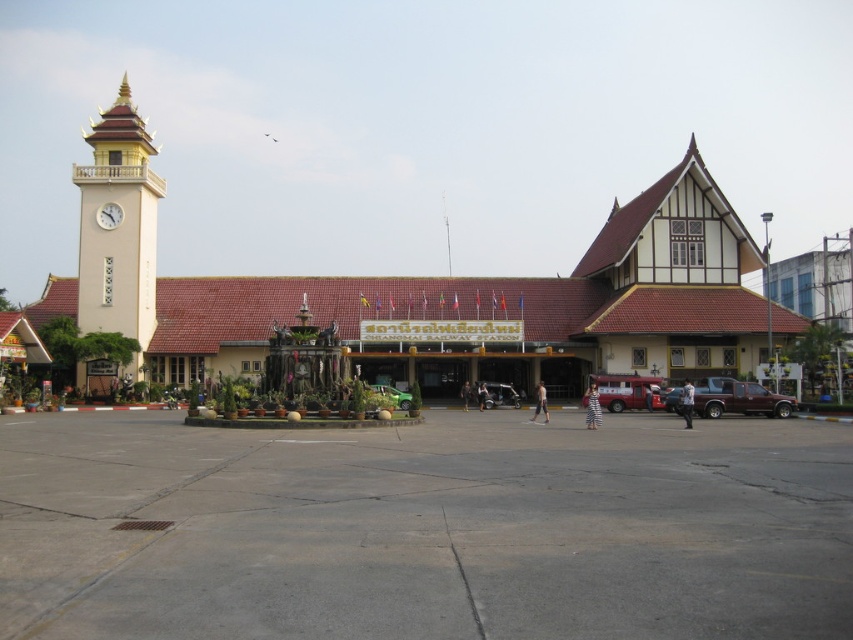
Question: Which object is farther from the camera taking this photo?

Choices:
 (A) brown wooden building at center
 (B) beige stucco clock tower at left
 (C) satin brown truck at center

Answer: (B)

Question: Does metallic red van at center have a larger size compared to metallic silver car at center?

Choices:
 (A) no
 (B) yes

Answer: (B)

Question: Can you confirm if concrete at center is positioned below green matte car at center?

Choices:
 (A) yes
 (B) no

Answer: (B)

Question: Which point is closer to the camera?

Choices:
 (A) (640, 273)
 (B) (294, 490)
 (C) (489, 397)
 (D) (671, 404)

Answer: (B)

Question: Estimate the real-world distances between objects in this image. Which object is farther from the green matte car at center?

Choices:
 (A) white glossy clock at upper left
 (B) metallic red van at center
 (C) concrete at center
 (D) beige stucco clock tower at left

Answer: (A)

Question: Can you confirm if beige stucco clock tower at left is bigger than green matte car at center?

Choices:
 (A) no
 (B) yes

Answer: (B)